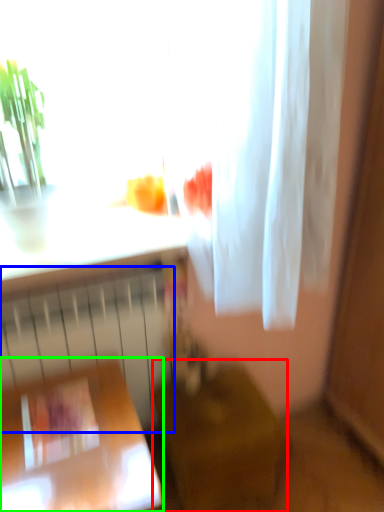
Question: Based on their relative distances, which object is nearer to furniture (highlighted by a red box)? Choose from radiator (highlighted by a blue box) and furniture (highlighted by a green box).

Choices:
 (A) radiator
 (B) furniture

Answer: (A)